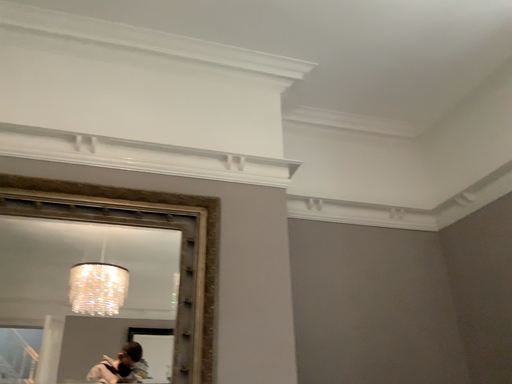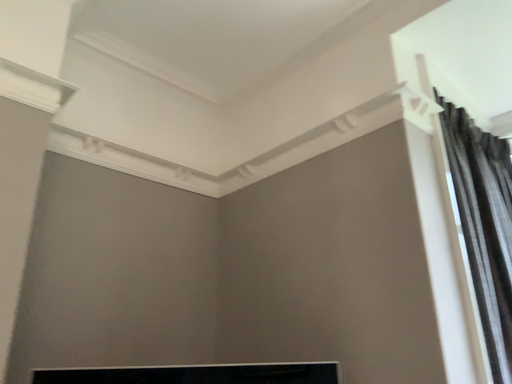
Question: How did the camera likely rotate when shooting the video?

Choices:
 (A) rotated upward
 (B) rotated downward

Answer: (B)